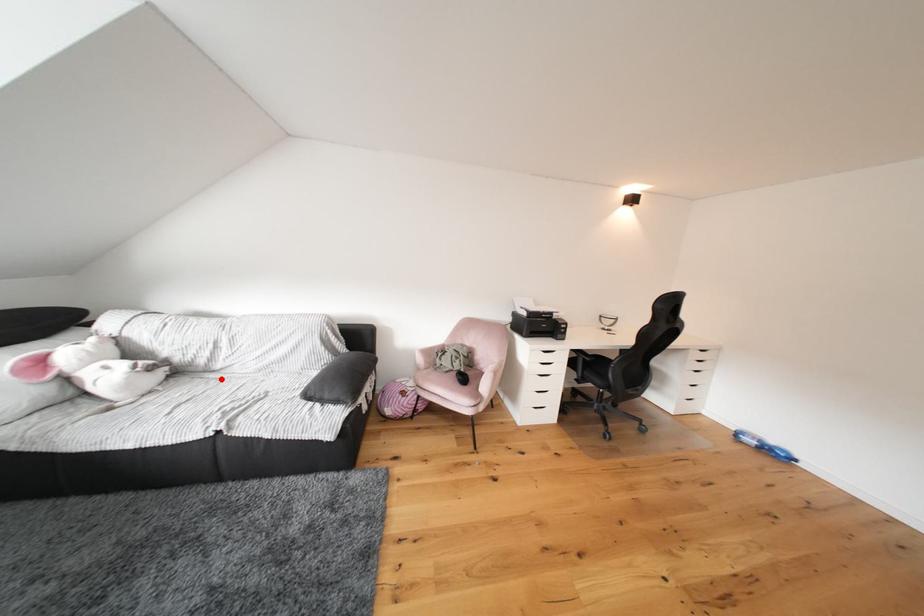
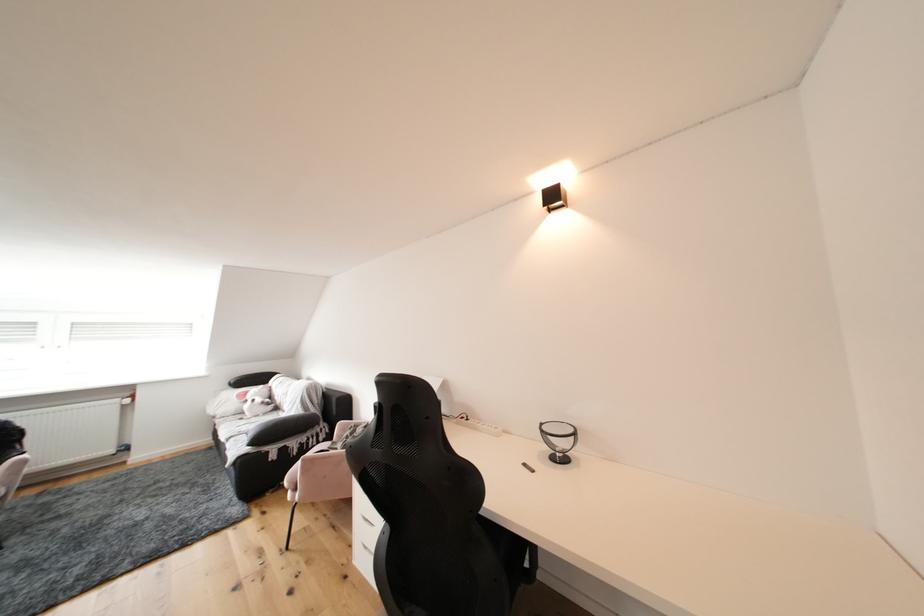
Find the pixel in the second image that matches the highlighted location in the first image.

(290, 416)